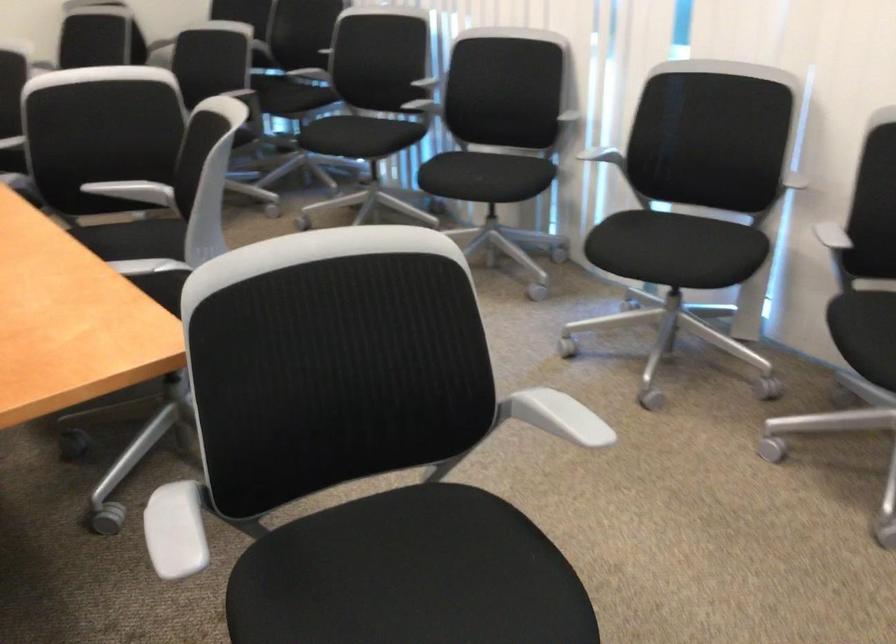
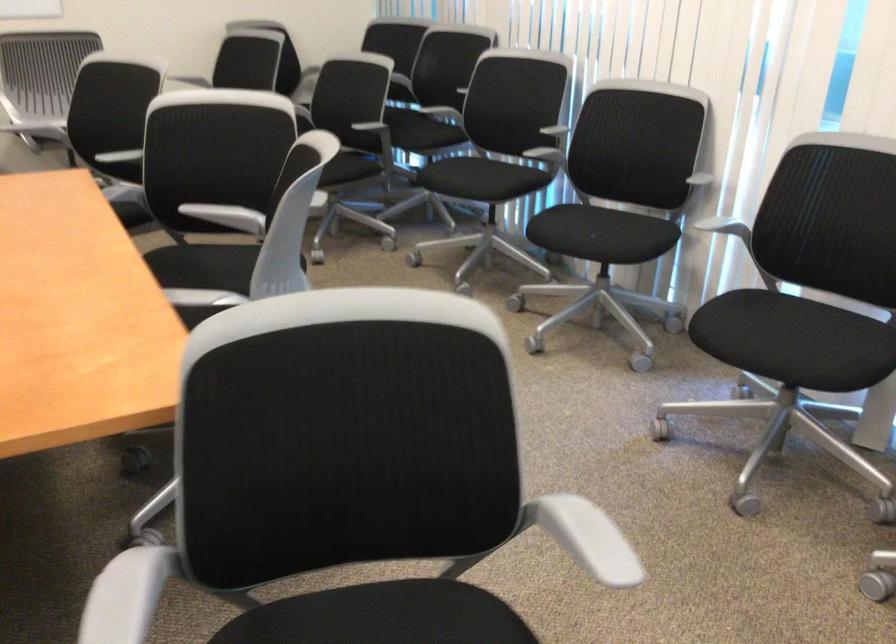
Where in the second image is the point corresponding to (x=115, y=259) from the first image?

(202, 275)